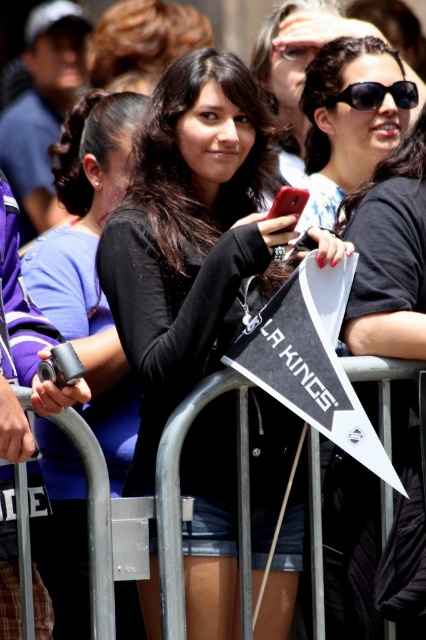
Locate an element on the screen. This screenshot has height=640, width=426. matte black phone at center is located at coordinates (190, 236).

Between point (204, 616) and point (368, 292), which one is positioned in front?

Point (368, 292) is more forward.

Locate an element on the screen. matte black phone at center is located at coordinates (190, 236).

Which is more to the left, black matte shirt at center or black matte sunglasses at upper right?

black matte shirt at center

Is point (78, 100) positioned in front of point (359, 577)?

No, (78, 100) is further to viewer.

Identify the location of black matte shirt at center. The image size is (426, 640). (91, 262).

Is black matte sunglasses at upper right further to camera compared to matte black sunglasses at upper right?

No, black matte sunglasses at upper right is closer to the viewer.

Who is more forward, (396,566) or (386,104)?

Positioned in front is point (396,566).

Does point (397, 257) lie behind point (411, 108)?

No, it is not.

Identify the location of black matte sunglasses at upper right. The image size is (426, 640). (389, 253).